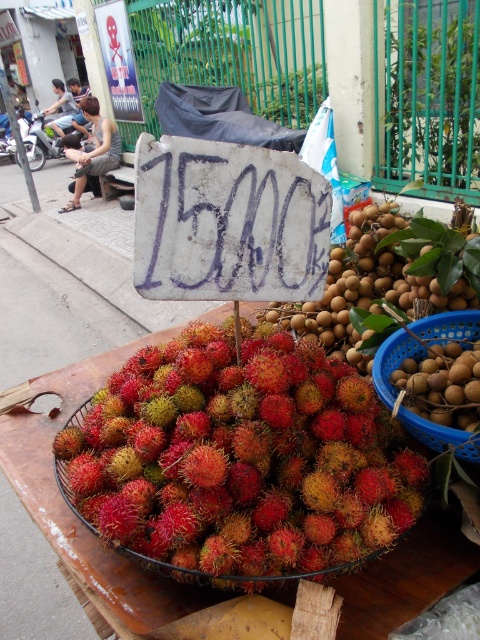
Question: Among these objects, which one is nearest to the camera?

Choices:
 (A) gray fabric bag at upper left
 (B) brown matte longan at center

Answer: (B)

Question: Is gray fabric bag at upper left to the right of dark gray fabric bag at upper left from the viewer's perspective?

Choices:
 (A) yes
 (B) no

Answer: (A)

Question: Does brown matte longan at center have a lesser width compared to brown matte longan at center-right?

Choices:
 (A) yes
 (B) no

Answer: (B)

Question: Which of the following is the farthest from the observer?

Choices:
 (A) hairy red rambutan at center
 (B) gray fabric bag at upper left

Answer: (B)

Question: Considering the relative positions of brown matte longan at center and dark gray fabric bag at upper left in the image provided, where is brown matte longan at center located with respect to dark gray fabric bag at upper left?

Choices:
 (A) below
 (B) above

Answer: (A)

Question: Among these points, which one is farthest from the camera?

Choices:
 (A) (303, 323)
 (B) (104, 120)
 (C) (421, 385)

Answer: (B)